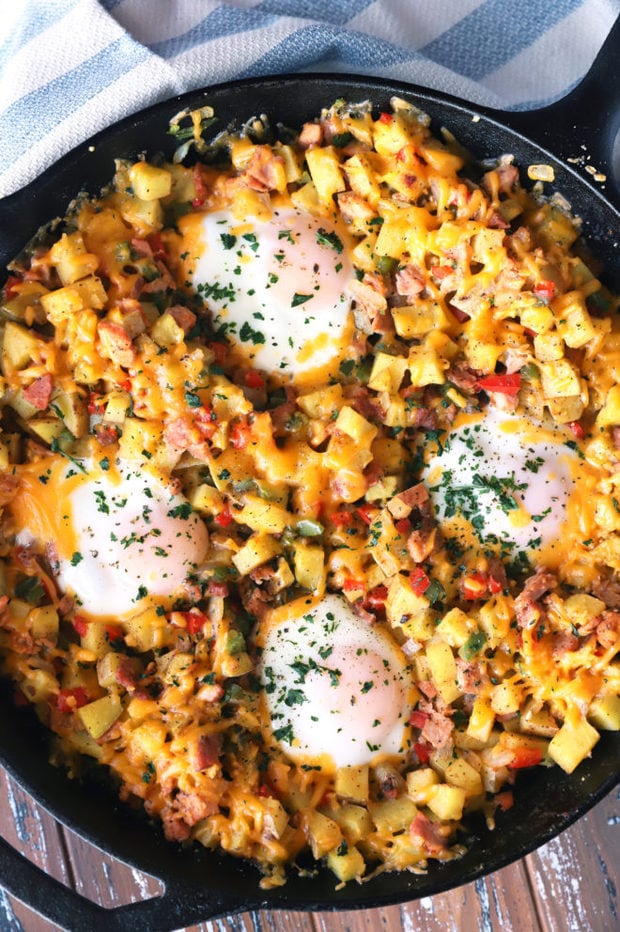
Identify the location of table. Image resolution: width=620 pixels, height=932 pixels. (547, 875).